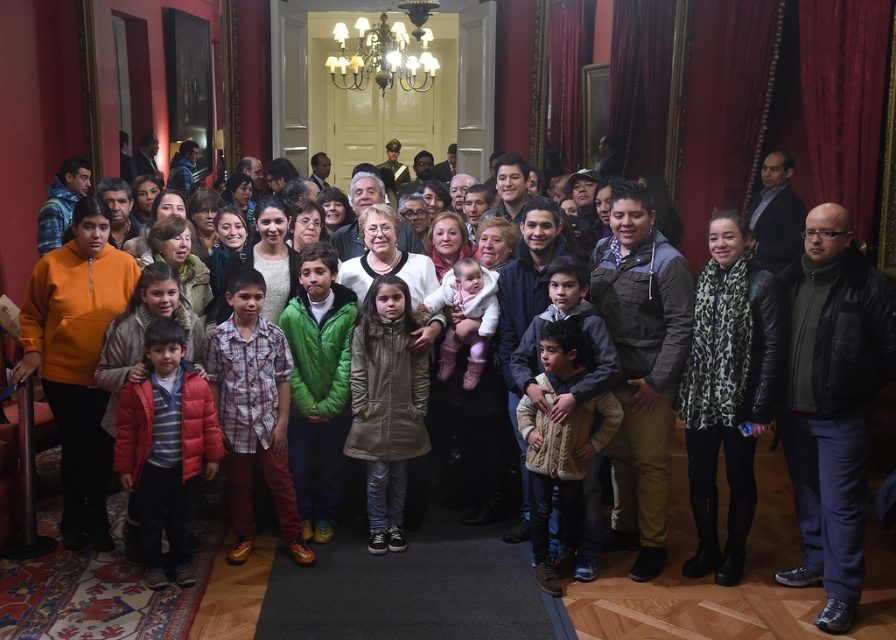
Is tan quilted coat at center wider than white fluffy coat at center?

Correct, the width of tan quilted coat at center exceeds that of white fluffy coat at center.

Consider the image. Is tan quilted coat at center to the right of white fluffy coat at center from the viewer's perspective?

Incorrect, tan quilted coat at center is not on the right side of white fluffy coat at center.

Which is behind, point (358, 452) or point (450, 294)?

The point (450, 294) is more distant.

Identify the location of tan quilted coat at center. The height and width of the screenshot is (640, 896). (386, 404).

Is matte red puffer jacket at lower left below white fluffy coat at center?

Indeed, matte red puffer jacket at lower left is positioned under white fluffy coat at center.

Which is more to the right, matte red puffer jacket at lower left or white fluffy coat at center?

white fluffy coat at center is more to the right.

Locate an element on the screen. This screenshot has height=640, width=896. matte red puffer jacket at lower left is located at coordinates (165, 449).

Where is `matte red puffer jacket at lower left`? matte red puffer jacket at lower left is located at coordinates point(165,449).

Based on the photo, who is shorter, matte red puffer jacket at lower left or tan quilted coat at center?

With less height is matte red puffer jacket at lower left.

Who is positioned more to the right, matte red puffer jacket at lower left or tan quilted coat at center?

Positioned to the right is tan quilted coat at center.

Between point (142, 396) and point (371, 282), which one is positioned behind?

Point (371, 282)

The width and height of the screenshot is (896, 640). In order to click on matte red puffer jacket at lower left in this screenshot , I will do `click(165, 449)`.